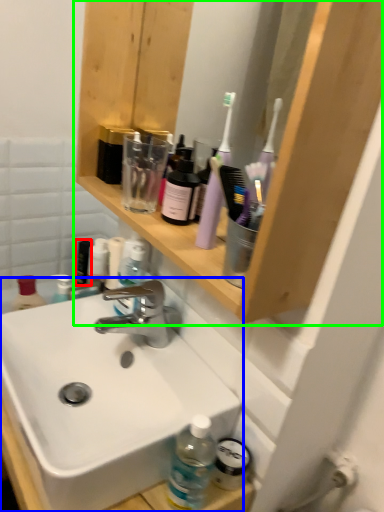
Question: Based on their relative distances, which object is farther from toiletry (highlighted by a red box)? Choose from sink (highlighted by a blue box) and shelf (highlighted by a green box).

Choices:
 (A) sink
 (B) shelf

Answer: (B)